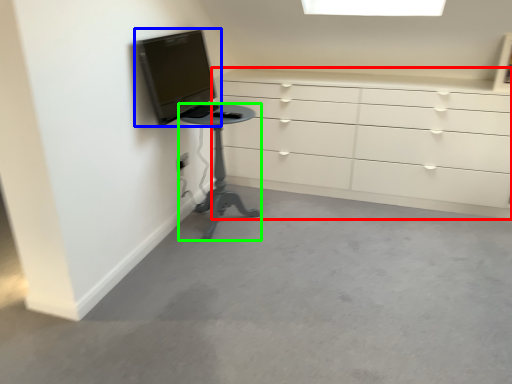
Question: Which object is positioned farthest from chest of drawers (highlighted by a red box)? Select from television (highlighted by a blue box) and furniture (highlighted by a green box).

Choices:
 (A) television
 (B) furniture

Answer: (A)